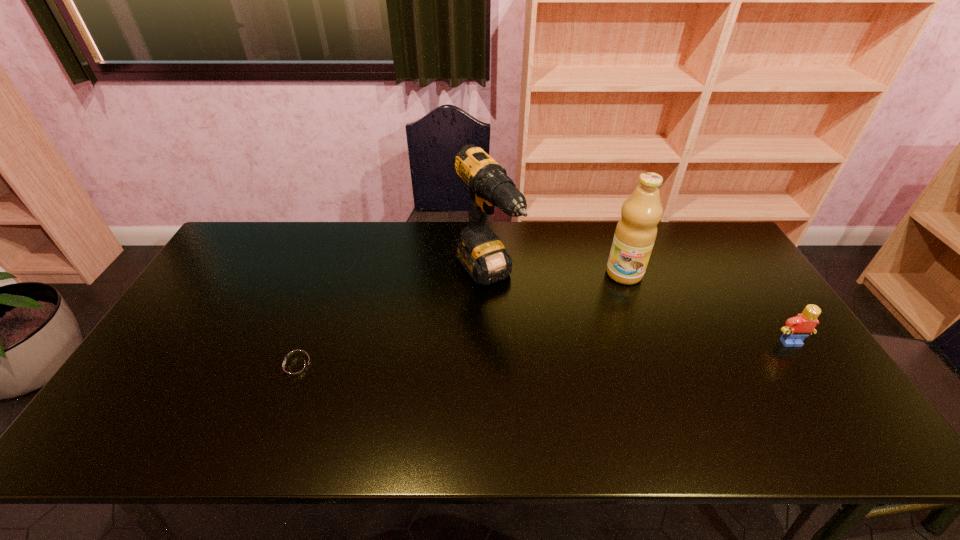
Find the location of a particular element. This screenshot has width=960, height=540. vacant region between the Lego and the olive oil is located at coordinates (708, 308).

Identify the location of free space between the second object from right to left and the second object from left to right. The image size is (960, 540). (555, 274).

Image resolution: width=960 pixels, height=540 pixels. What are the coordinates of `empty space that is in between the leftmost object and the drill` in the screenshot? It's located at (391, 321).

At what (x,y) coordinates should I click in order to perform the action: click on empty space between the olive oil and the rightmost object. Please return your answer as a coordinate pair (x, y). Looking at the image, I should click on (708, 308).

Image resolution: width=960 pixels, height=540 pixels. In order to click on blank region between the second object from right to left and the drill in this screenshot , I will do `click(555, 274)`.

What are the coordinates of `object that stands as the closest to the watch` in the screenshot? It's located at (482, 254).

Select which object appears as the closest to the drill. Please provide its 2D coordinates. Your answer should be formatted as a tuple, i.e. [(x, y)], where the tuple contains the x and y coordinates of a point satisfying the conditions above.

[(636, 231)]